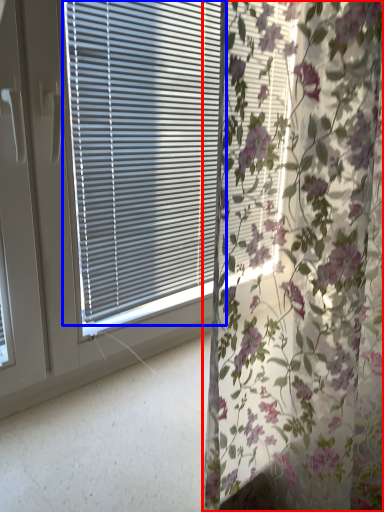
Question: Which point is closer to the camera, curtain (highlighted by a red box) or window blind (highlighted by a blue box)?

Choices:
 (A) curtain
 (B) window blind

Answer: (A)